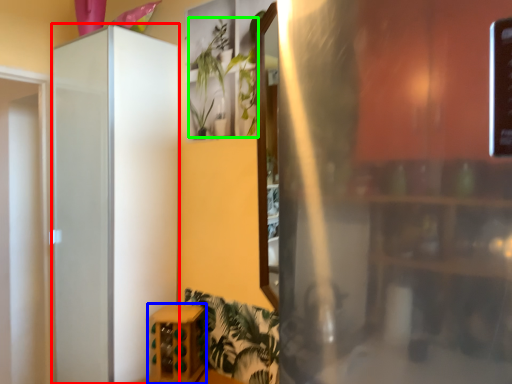
Question: Which is farther away from screen door (highlighted by a red box)? furniture (highlighted by a blue box) or plant (highlighted by a green box)?

Choices:
 (A) furniture
 (B) plant

Answer: (B)